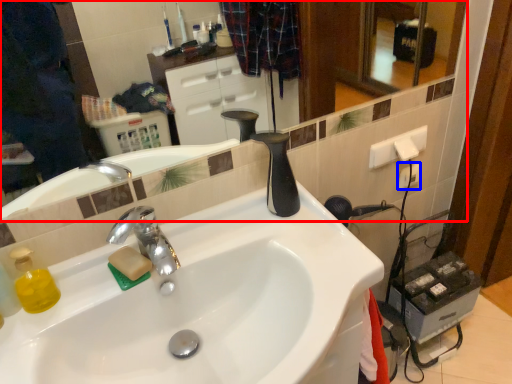
Question: Which point is further to the camera, mirror (highlighted by a red box) or electric outlet (highlighted by a blue box)?

Choices:
 (A) mirror
 (B) electric outlet

Answer: (B)